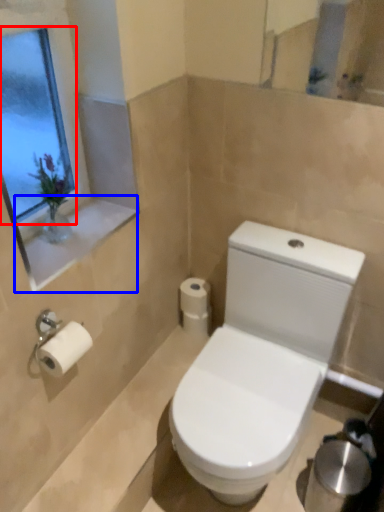
Question: Among these objects, which one is farthest to the camera, window screen (highlighted by a red box) or window sill (highlighted by a blue box)?

Choices:
 (A) window screen
 (B) window sill

Answer: (B)